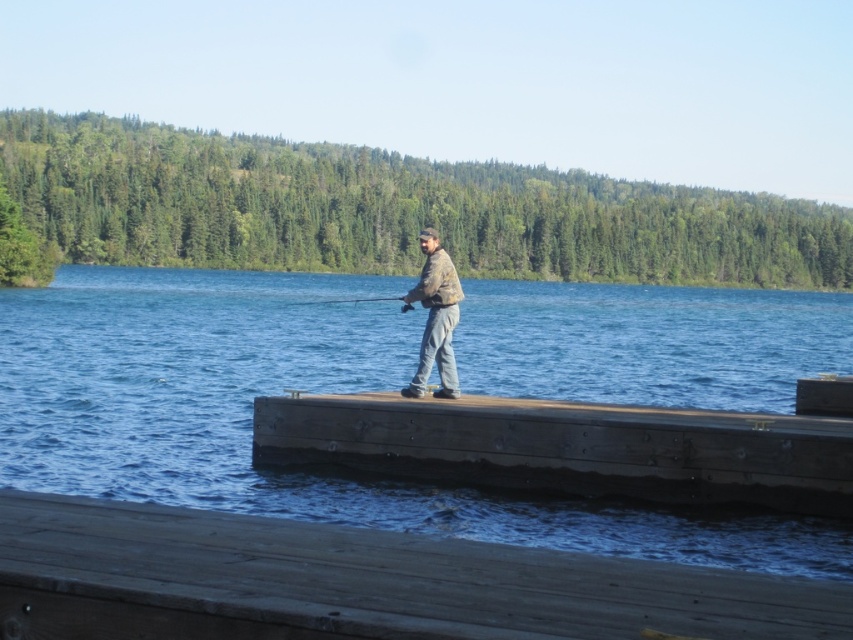
Question: Which of the following is the farthest from the observer?

Choices:
 (A) brown wood dock at center
 (B) blue water at center
 (C) brown wooden dock at center
 (D) smooth wooden fishing pole at center

Answer: (D)

Question: Is blue water at center further to the viewer compared to brown wood dock at center?

Choices:
 (A) no
 (B) yes

Answer: (A)

Question: Which point is closer to the camera?

Choices:
 (A) (276, 547)
 (B) (300, 304)

Answer: (A)

Question: Does camouflage fabric fisherman at center appear over smooth wooden fishing pole at center?

Choices:
 (A) yes
 (B) no

Answer: (B)

Question: Can you confirm if brown wood dock at center is positioned above smooth wooden fishing pole at center?

Choices:
 (A) yes
 (B) no

Answer: (B)

Question: Which point is closer to the camera taking this photo?

Choices:
 (A) (749, 604)
 (B) (21, 381)
 (C) (418, 374)
 (D) (427, 406)

Answer: (A)